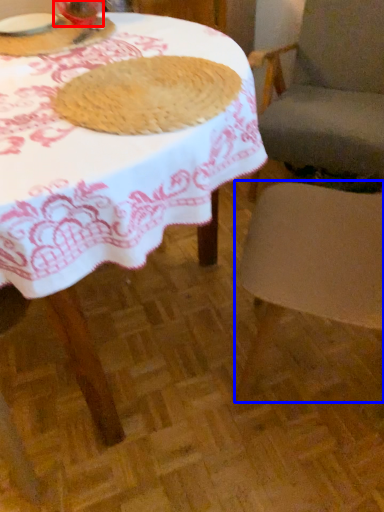
Question: Which object appears closest to the camera in this image, tableware (highlighted by a red box) or chair (highlighted by a blue box)?

Choices:
 (A) tableware
 (B) chair

Answer: (B)